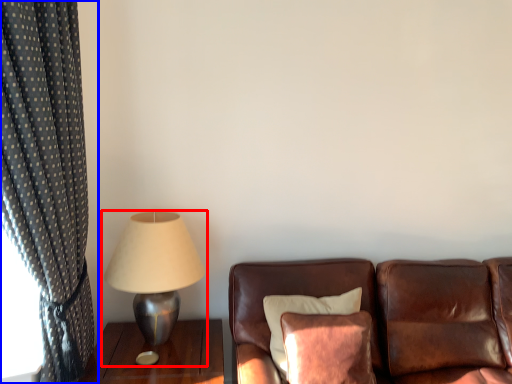
Question: Which point is closer to the camera, lamp (highlighted by a red box) or curtain (highlighted by a blue box)?

Choices:
 (A) lamp
 (B) curtain

Answer: (B)